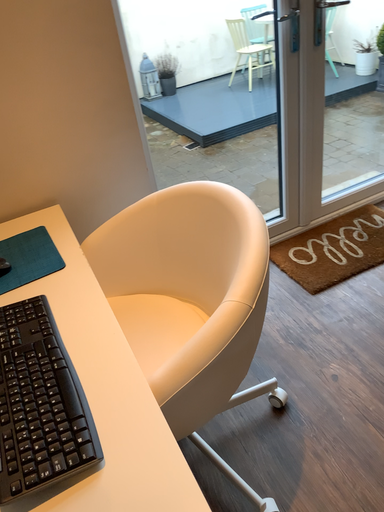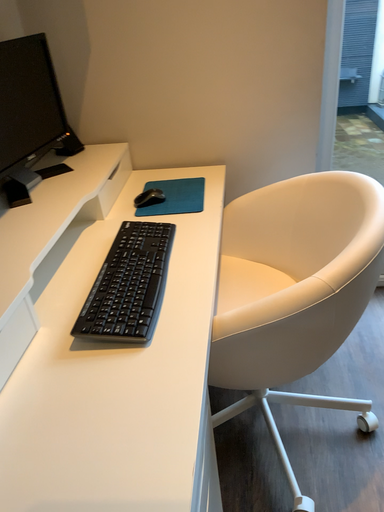
Question: How did the camera likely rotate when shooting the video?

Choices:
 (A) rotated left
 (B) rotated right

Answer: (A)